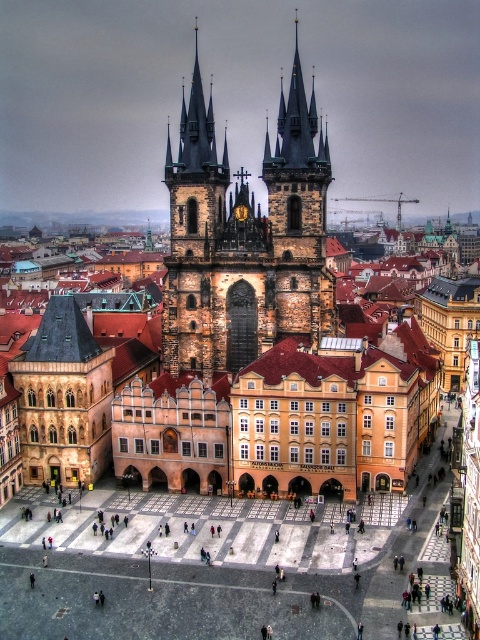
Question: Which point is farther to the camera?

Choices:
 (A) brown stone tower at center
 (B) dark stone church spires at center

Answer: (B)

Question: Is dark stone church spires at center further to the viewer compared to brown stone tower at center?

Choices:
 (A) no
 (B) yes

Answer: (B)

Question: Is dark stone church spires at center smaller than brown stone tower at center?

Choices:
 (A) no
 (B) yes

Answer: (A)

Question: Is dark stone church spires at center further to camera compared to brown stone tower at center?

Choices:
 (A) yes
 (B) no

Answer: (A)

Question: Which of the following is the closest to the observer?

Choices:
 (A) dark stone church spires at center
 (B) brown stone tower at center

Answer: (B)

Question: Which point is closer to the camera?

Choices:
 (A) brown stone tower at center
 (B) dark stone church spires at center

Answer: (A)